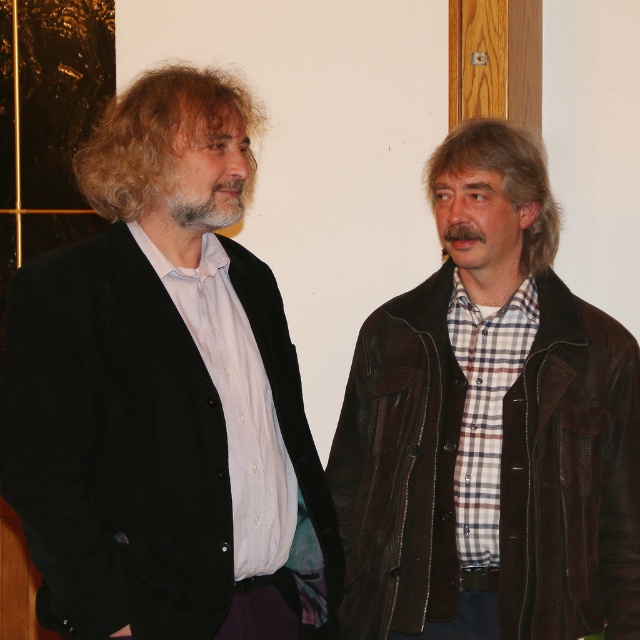
You are a photographer setting up a photo shoot in the described scene. You need to position a backdrop that is 1.8 meters tall to ensure it covers both the brown leather jacket at right and the graywoollybeard at center. Will the backdrop be tall enough based on their heights?

The brown leather jacket at right is taller than graywoollybeard at center. Since the backdrop is 1.8 meters tall, it should be sufficient to cover both as the taller object is the brown leather jacket at right, and 1.8 meters likely exceeds their height.

You are a tailor measuring jackets for two clients. The first client is wearing the black velvet jacket at left, and the second is wearing the brown leather jacket at right. Which jacket has a shorter length?

The black velvet jacket at left has a lesser height compared to the brown leather jacket at right, so the black velvet jacket at left is shorter in length.

You are a fashion designer who needs to create outfits for both individuals in the image. The brown leather jacket at right and the graywoollybeard at center are key elements. Considering their sizes, which item would require more fabric to produce?

The brown leather jacket at right requires more fabric because it is bigger than the graywoollybeard at center.